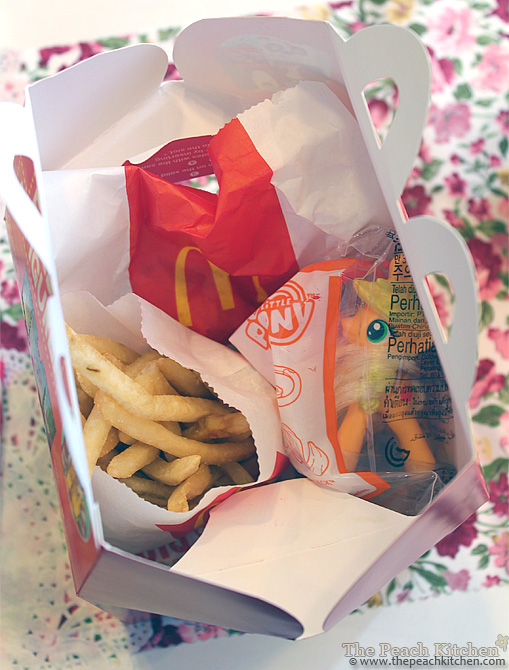
This screenshot has width=509, height=670. What are the coordinates of `orange pony toy` in the screenshot? It's located at (359, 419), (380, 366), (397, 302).